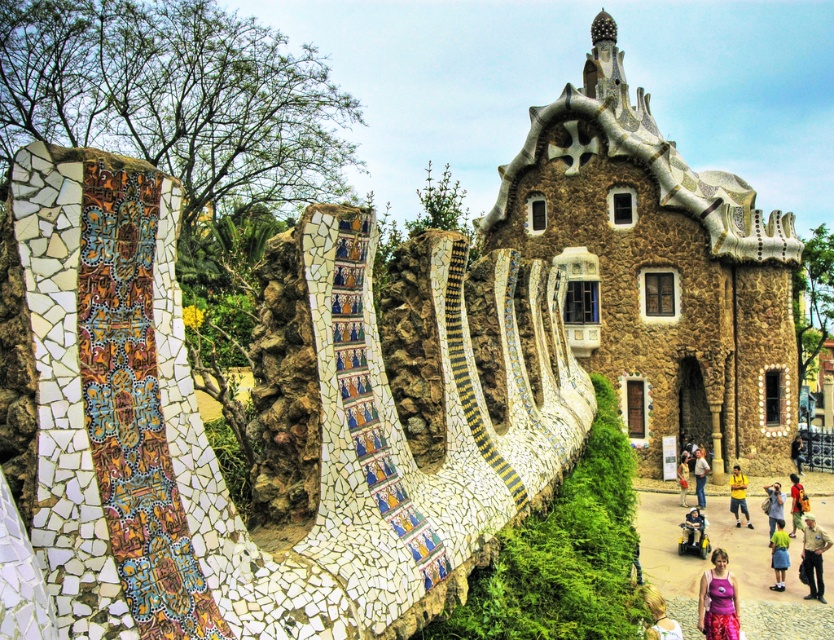
You are a tourist standing at the entrance of the architectural structure. You see the brick cobblestone path at lower center and the khaki uniform at lower right. Which object is located to the left of the other?

The brick cobblestone path at lower center is positioned on the left side of khaki uniform at lower right.

You are a tourist visiting Park Guell and want to walk along the brick cobblestone path at lower center while wearing your khaki uniform at lower right. Can you walk on the path without your uniform touching the sides of the path?

The brick cobblestone path at lower center is wider than the khaki uniform at lower right, so there will be enough space to walk without the uniform touching the sides.

You are standing on the purple fabric at lower right and want to walk to the brick cobblestone path at lower center. In which direction should you move?

The brick cobblestone path at lower center is to the right of the purple fabric at lower right, so you should move to the right to reach it.